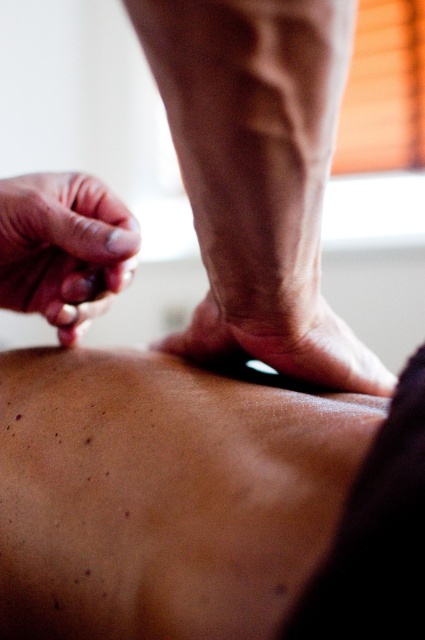
Based on the photo, who is more distant from viewer, [78,188] or [343,385]?

Positioned behind is point [78,188].

Is smooth skin hand at upper left to the left of dry skin at center from the viewer's perspective?

Correct, you'll find smooth skin hand at upper left to the left of dry skin at center.

What do you see at coordinates (64, 248) in the screenshot?
I see `smooth skin hand at upper left` at bounding box center [64, 248].

Where is `smooth skin hand at upper left`? The height and width of the screenshot is (640, 425). smooth skin hand at upper left is located at coordinates (64, 248).

Does smooth skin at center have a larger size compared to smooth skin leg at center?

Yes.

How much distance is there between smooth skin at center and smooth skin leg at center?

They are 3.66 inches apart.

You are a GUI agent. You are given a task and a screenshot of the screen. Output one action in this format:
    pyautogui.click(x=<x>, y=<y>)
    Task: Click on the smooth skin at center
    
    Given the screenshot: What is the action you would take?
    pyautogui.click(x=164, y=496)

Is smooth skin at center positioned before dry skin at center?

Yes, smooth skin at center is closer to the viewer.

Describe the element at coordinates (164, 496) in the screenshot. I see `smooth skin at center` at that location.

Image resolution: width=425 pixels, height=640 pixels. I want to click on smooth skin at center, so click(x=164, y=496).